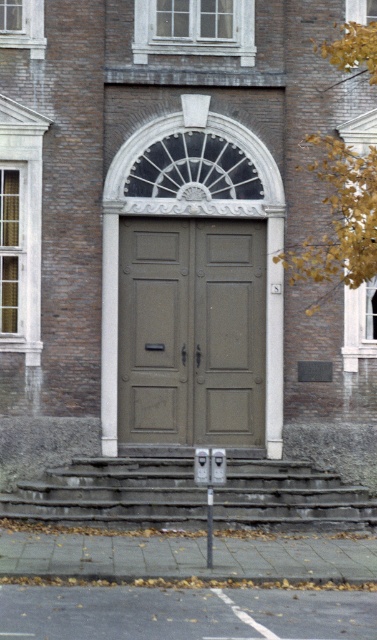
This screenshot has width=377, height=640. I want to click on matte wood door at center, so click(191, 332).

Find the location of a particular element. This screenshot has width=377, height=640. matte wood door at center is located at coordinates (191, 332).

The height and width of the screenshot is (640, 377). I want to click on matte wood door at center, so click(191, 332).